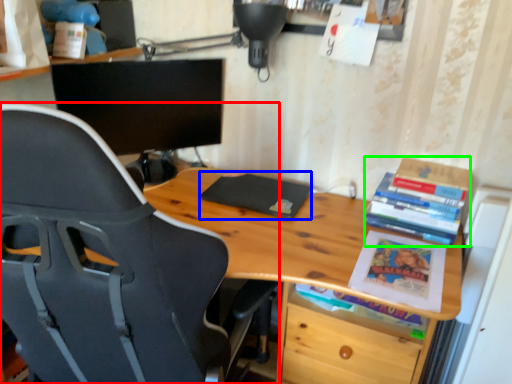
Question: Considering the real-world distances, which object is closest to chair (highlighted by a red box)? paperback book (highlighted by a blue box) or book (highlighted by a green box).

Choices:
 (A) paperback book
 (B) book

Answer: (A)